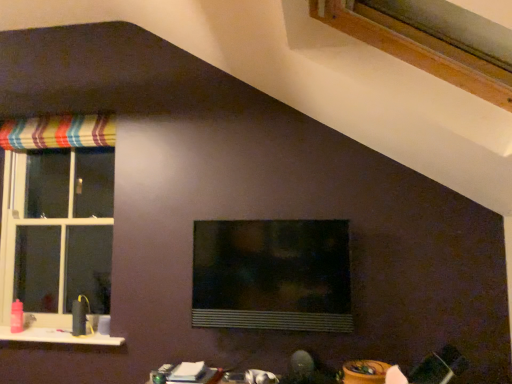
Question: Does point (165, 374) appear closer or farther from the camera than point (67, 332)?

Choices:
 (A) closer
 (B) farther

Answer: (A)

Question: Is white glossy table at lower center to the left or to the right of white glossy window sill at lower left in the image?

Choices:
 (A) left
 (B) right

Answer: (B)

Question: Which object is the farthest from the white glossy window sill at lower left?

Choices:
 (A) white glossy table at lower center
 (B) striped fabric curtain at upper left
 (C) wooden frame at upper right, placed as the first window when sorted from front to back
 (D) white plastic window at left, arranged as the 1th window when viewed from the left
 (E) transparent glass window at center, which is the 2th window in front-to-back order

Answer: (C)

Question: Estimate the real-world distances between objects in this image. Which object is farther from the transparent glass window at center, arranged as the 2th window when viewed from the left?

Choices:
 (A) white glossy window sill at lower left
 (B) wooden frame at upper right, placed as the first window when sorted from front to back
 (C) white plastic window at left, the third window from the front
 (D) white glossy table at lower center
 (E) striped fabric curtain at upper left

Answer: (E)